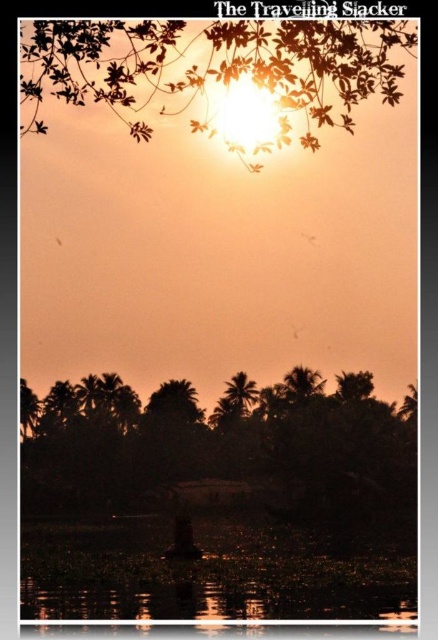
Question: Does silhouette leafy branch at upper center have a smaller size compared to translucent dark water at lower center?

Choices:
 (A) yes
 (B) no

Answer: (B)

Question: Is silhouette palm trees at lower center to the left of silhouette leafy branch at upper center from the viewer's perspective?

Choices:
 (A) yes
 (B) no

Answer: (A)

Question: Estimate the real-world distances between objects in this image. Which object is farther from the silhouette leafy branch at upper center?

Choices:
 (A) silhouette palm trees at lower center
 (B) translucent dark water at lower center

Answer: (A)

Question: Which point is closer to the camera?

Choices:
 (A) (137, 140)
 (B) (254, 442)

Answer: (A)

Question: Based on their relative distances, which object is nearer to the silhouette leafy branch at upper center?

Choices:
 (A) silhouette palm trees at lower center
 (B) translucent dark water at lower center

Answer: (B)

Question: Can you confirm if silhouette palm trees at lower center is smaller than silhouette leafy branch at upper center?

Choices:
 (A) no
 (B) yes

Answer: (B)